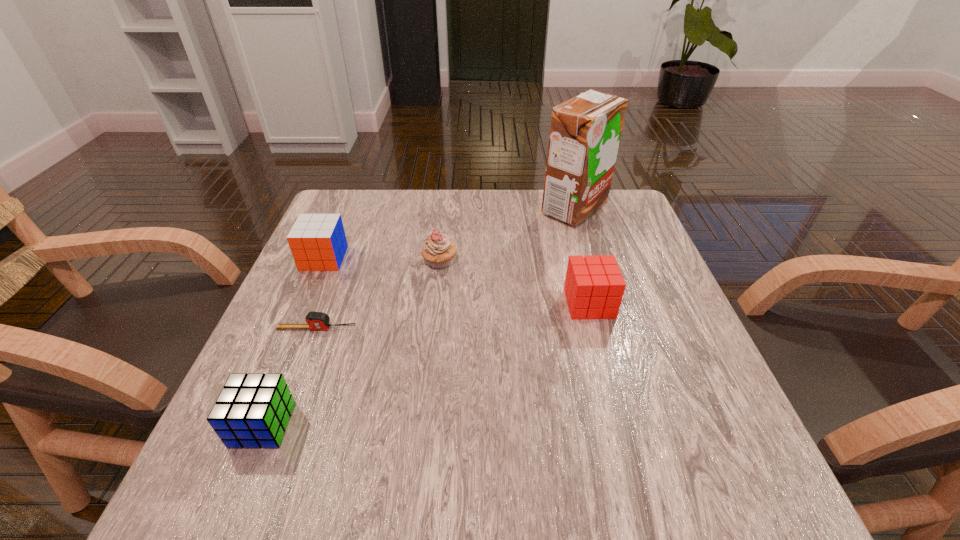
This screenshot has width=960, height=540. I want to click on carton located at the right edge, so click(x=585, y=131).

You are a GUI agent. You are given a task and a screenshot of the screen. Output one action in this format:
    pyautogui.click(x=<x>, y=<y>)
    Task: Click on the cube at the right edge
    This screenshot has height=540, width=960.
    Given the screenshot: What is the action you would take?
    pyautogui.click(x=594, y=286)

Find the location of `object at the near left corner`. object at the near left corner is located at coordinates (252, 411).

At what (x,y) coordinates should I click in order to perform the action: click on object present at the far right corner. Please return your answer as a coordinate pair (x, y). Looking at the image, I should click on (585, 131).

Image resolution: width=960 pixels, height=540 pixels. I want to click on vacant space at the far edge of the desktop, so click(557, 220).

The image size is (960, 540). What are the coordinates of `free location at the near edge` in the screenshot? It's located at (350, 454).

The image size is (960, 540). In the image, there is a desktop. In order to click on blank space at the left edge in this screenshot , I will do `click(307, 289)`.

In order to click on vacant space at the right edge of the desktop in this screenshot , I will do `click(660, 285)`.

I want to click on vacant space at the far left corner of the desktop, so click(x=348, y=220).

Locate an element on the screen. vacant space at the far right corner of the desktop is located at coordinates (609, 224).